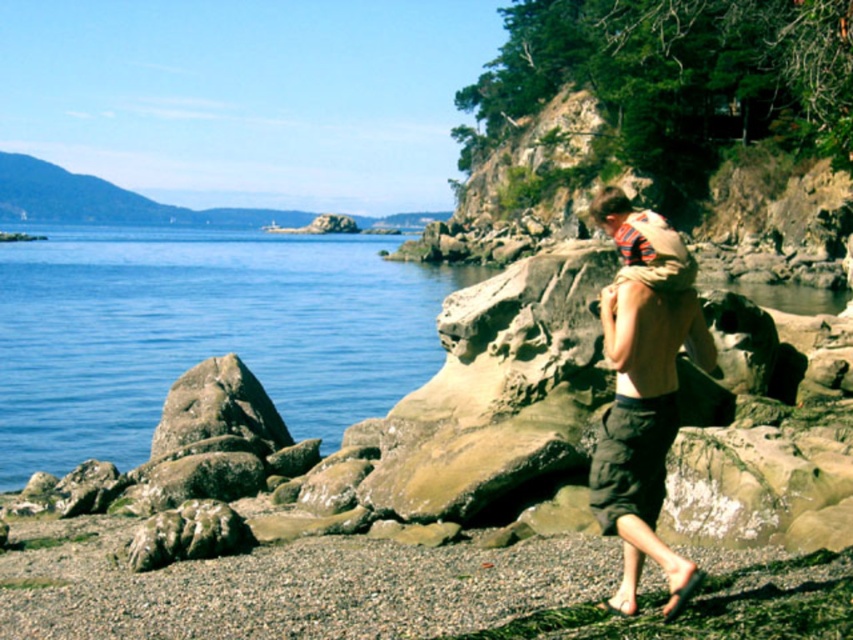
From the picture: You are standing on the rocky shoreline and want to walk to the blue smooth water at left without getting your dark brown cotton shorts at lower right wet. Which direction should you move?

You should move to the left towards the blue smooth water at left since it is positioned on the left side of your dark brown cotton shorts at lower right, allowing you to reach the water without getting your shorts wet.

You are a photographer standing on the rocky shoreline and want to capture the blue smooth water at left in your shot. Based on its 2D coordinates, where should you position your camera to ensure the water is centered in the frame?

To center the blue smooth water at left in the frame, position your camera so that the center of the frame aligns with the coordinates point (201, 332).